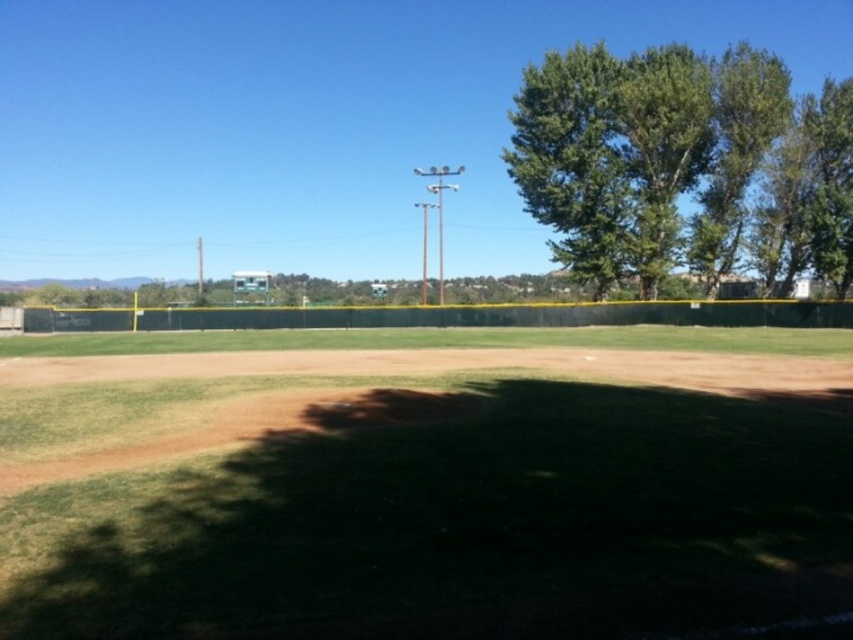
Is point (132, 442) more distant than point (566, 189)?

No, (132, 442) is in front of (566, 189).

Is green grass at center positioned at the back of green leafy tree at upper right?

No, it is in front of green leafy tree at upper right.

Does point (257, 632) lie in front of point (805, 161)?

Yes, point (257, 632) is in front of point (805, 161).

Where is `green grass at center`? green grass at center is located at coordinates (424, 483).